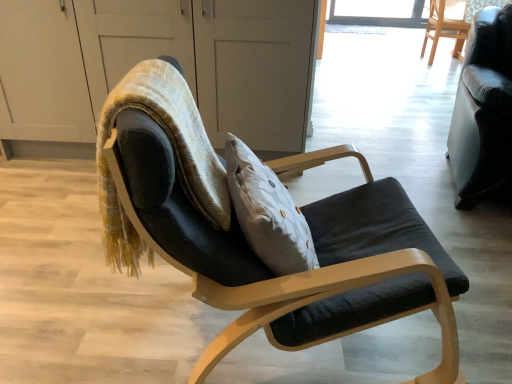
Question: From the image's perspective, would you say velvet textured bean bag chair at center is shown under matte black chair at center, which is the 1th chair in bottom-to-top order?

Choices:
 (A) no
 (B) yes

Answer: (A)

Question: From the image's perspective, is velvet textured bean bag chair at center on matte black chair at center, which appears as the 1th chair when viewed from the left?

Choices:
 (A) yes
 (B) no

Answer: (A)

Question: Is velvet textured bean bag chair at center not near matte black chair at center, which is the third chair from back to front?

Choices:
 (A) no
 (B) yes

Answer: (A)

Question: Considering the relative sizes of velvet textured bean bag chair at center and matte black chair at center, which is the 1th chair in bottom-to-top order, in the image provided, is velvet textured bean bag chair at center shorter than matte black chair at center, which is the 1th chair in bottom-to-top order,?

Choices:
 (A) no
 (B) yes

Answer: (B)

Question: Is the depth of velvet textured bean bag chair at center greater than that of matte black chair at center, which is the third chair from back to front?

Choices:
 (A) no
 (B) yes

Answer: (B)

Question: Considering the positions of point (459, 56) and point (185, 87), is point (459, 56) closer or farther from the camera than point (185, 87)?

Choices:
 (A) farther
 (B) closer

Answer: (A)

Question: From the image's perspective, is wooden chair at upper right, which is the first chair from top to bottom, above or below velvet textured bean bag chair at center?

Choices:
 (A) above
 (B) below

Answer: (A)

Question: Based on their positions, is wooden chair at upper right, which is the first chair from top to bottom, located to the left or right of velvet textured bean bag chair at center?

Choices:
 (A) right
 (B) left

Answer: (A)

Question: In terms of height, does wooden chair at upper right, arranged as the first chair when viewed from the back, look taller or shorter compared to velvet textured bean bag chair at center?

Choices:
 (A) short
 (B) tall

Answer: (B)

Question: From a real-world perspective, is wooden chair at upper right, positioned as the 1th chair in right-to-left order, physically located above or below transparent glass screen door at upper center?

Choices:
 (A) above
 (B) below

Answer: (B)

Question: Considering the positions of wooden chair at upper right, the 3th chair from the bottom, and transparent glass screen door at upper center in the image, is wooden chair at upper right, the 3th chair from the bottom, taller or shorter than transparent glass screen door at upper center?

Choices:
 (A) tall
 (B) short

Answer: (B)

Question: Is wooden chair at upper right, which is the third chair from front to back, situated inside transparent glass screen door at upper center or outside?

Choices:
 (A) inside
 (B) outside

Answer: (B)

Question: Looking at the image, does wooden chair at upper right, which is the first chair from top to bottom, seem bigger or smaller compared to transparent glass screen door at upper center?

Choices:
 (A) small
 (B) big

Answer: (A)

Question: In terms of width, does wooden chair at upper right, the 3th chair from the bottom, look wider or thinner when compared to black leather couch at right, which appears as the second chair when viewed from the front?

Choices:
 (A) wide
 (B) thin

Answer: (B)

Question: In terms of height, does wooden chair at upper right, which is the third chair from front to back, look taller or shorter compared to black leather couch at right, which is the 2th chair in right-to-left order?

Choices:
 (A) short
 (B) tall

Answer: (A)